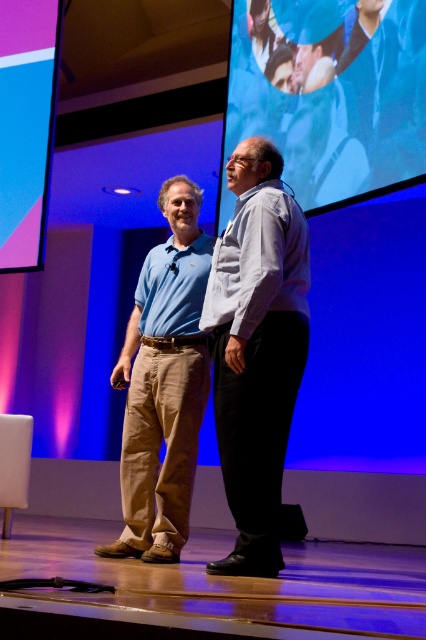
You are a photographer in the audience and want to capture both men in a single photo. Since the light blue shirt at center and the matte blue shirt at center are positioned differently, which one should you focus on first to ensure both are in frame?

The light blue shirt at center is located above the matte blue shirt at center, so focusing on the light blue shirt at center first will help ensure both are within the frame as the matte blue shirt at center is below it.

You are an event planner observing the stage setup. You notice the blue fabric at upper center and the matte blue shirt at center. Which one is closer to the audience?

The blue fabric at upper center is closer to the audience because it is in front of the matte blue shirt at center.

You are an event coordinator trying to set up a spotlight for the main speaker. You see two men on stage wearing light blue shirt at center and matte blue shirt at center. Which one should you direct the spotlight towards if the main speaker is the one closer to the audience?

The light blue shirt at center is closer to the viewer than the matte blue shirt at center, so you should direct the spotlight towards the light blue shirt at center.